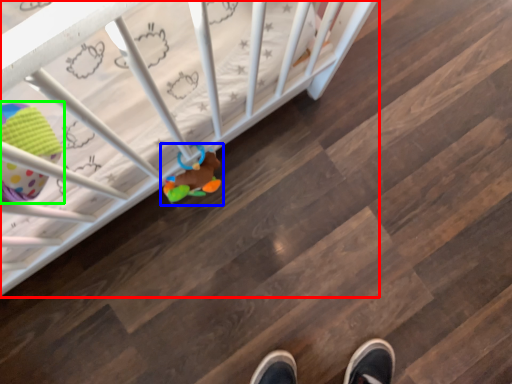
Question: Considering the real-world distances, which object is farthest from infant bed (highlighted by a red box)? toy (highlighted by a blue box) or toy (highlighted by a green box)?

Choices:
 (A) toy
 (B) toy

Answer: (B)